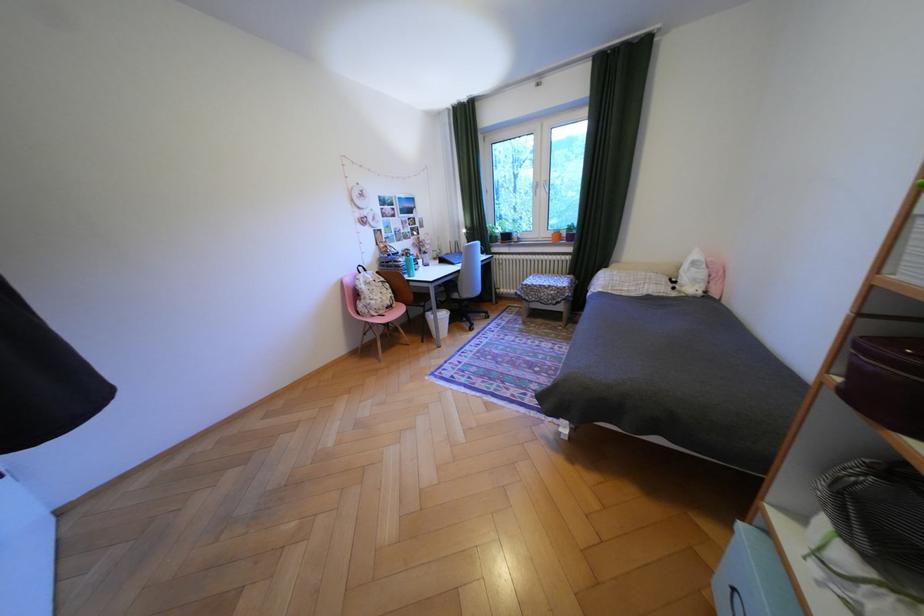
Identify the location of blue water bottle. (408, 262).